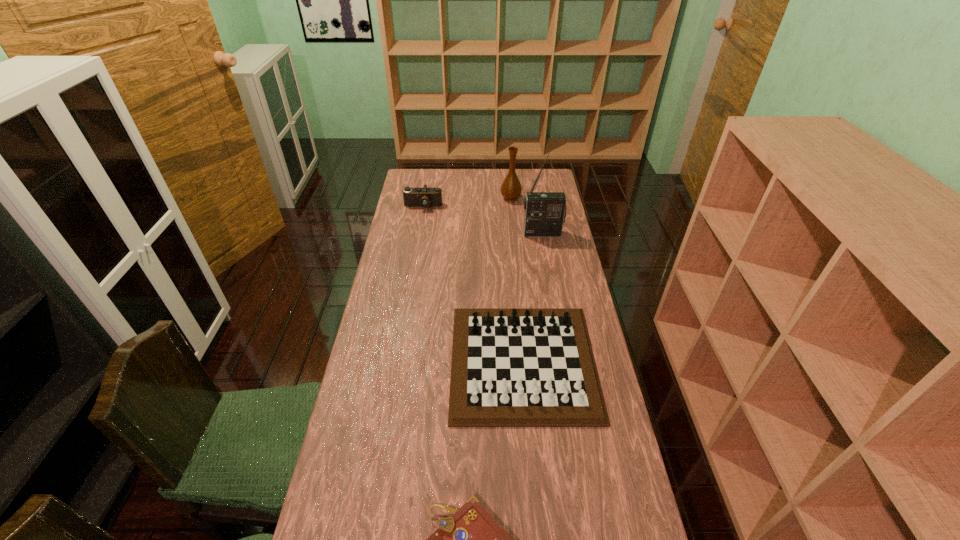
Where is `free spot between the radio receiver and the camera`? free spot between the radio receiver and the camera is located at coordinates (483, 220).

Where is `free spot between the fourth farthest object and the camera`? This screenshot has width=960, height=540. free spot between the fourth farthest object and the camera is located at coordinates click(x=473, y=284).

Point out which object is positioned as the nearest to the fourth shortest object. Please provide its 2D coordinates. Your answer should be formatted as a tuple, i.e. [(x, y)], where the tuple contains the x and y coordinates of a point satisfying the conditions above.

[(545, 212)]

Select which object is the fourth closest to the tallest object. Please provide its 2D coordinates. Your answer should be formatted as a tuple, i.e. [(x, y)], where the tuple contains the x and y coordinates of a point satisfying the conditions above.

[(470, 539)]

You are a GUI agent. You are given a task and a screenshot of the screen. Output one action in this format:
    pyautogui.click(x=<x>, y=<y>)
    Task: Click on the vacant space that satisfies the following two spatial constraints: 1. on the back side of the gameboard; 2. on the left side of the vase
    This screenshot has width=960, height=540.
    Given the screenshot: What is the action you would take?
    pyautogui.click(x=509, y=198)